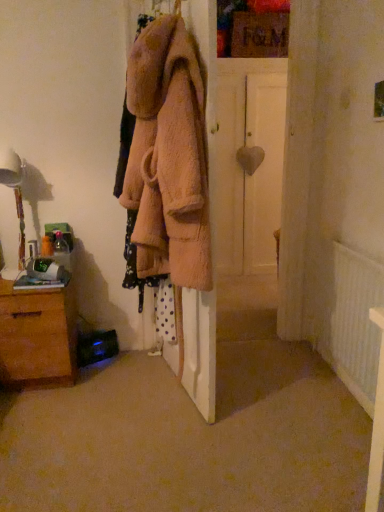
Identify the location of white textured radiator at lower right. This screenshot has width=384, height=512. (350, 319).

Where is `white glossy table lamp at left`? white glossy table lamp at left is located at coordinates (15, 193).

Considering the positions of points (76, 374) and (264, 206), is point (76, 374) farther from camera compared to point (264, 206)?

No, (76, 374) is closer to viewer.

Based on their positions, is brown wooden chest of drawers at lower left located to the left or right of white matte door at center?

Clearly, brown wooden chest of drawers at lower left is on the left of white matte door at center in the image.

From a real-world perspective, which is physically above, brown wooden chest of drawers at lower left or white matte door at center?

white matte door at center is physically above.

From the picture: How different are the orientations of brown wooden chest of drawers at lower left and white matte door at center in degrees?

The angular difference between brown wooden chest of drawers at lower left and white matte door at center is 2.53 degrees.

Is white textured radiator at lower right positioned far away from white matte door at center?

Indeed, white textured radiator at lower right is not near white matte door at center.

Would you say white textured radiator at lower right is to the left or to the right of white matte door at center in the picture?

white textured radiator at lower right is to the right of white matte door at center.

Which object is further away from the camera taking this photo, white textured radiator at lower right or white matte door at center?

white matte door at center is further from the camera.

Based on the photo, how much distance is there between white textured radiator at lower right and white matte door at center?

white textured radiator at lower right is 1.55 meters from white matte door at center.

Considering the positions of objects white glossy table lamp at left and soft pink fuzzy coat at center in the image provided, who is more to the right, white glossy table lamp at left or soft pink fuzzy coat at center?

Positioned to the right is soft pink fuzzy coat at center.

I want to click on clothing in front of the white glossy table lamp at left, so click(166, 157).

Is white glossy table lamp at left aimed at soft pink fuzzy coat at center?

No, white glossy table lamp at left is not oriented towards soft pink fuzzy coat at center.

In the scene shown: From the image's perspective, is white glossy table lamp at left on top of soft pink fuzzy coat at center?

Yes, from the image's perspective, white glossy table lamp at left is above soft pink fuzzy coat at center.

Is white textured radiator at lower right inside white matte door at center?

Definitely not — white textured radiator at lower right is not inside white matte door at center.

Consider the image. How far apart are white matte door at center and white textured radiator at lower right?

white matte door at center and white textured radiator at lower right are 1.55 meters apart.

The image size is (384, 512). Find the location of `radiator to the right of white matte door at center`. radiator to the right of white matte door at center is located at coordinates (350, 319).

Who is taller, white matte door at center or white textured radiator at lower right?

white matte door at center.

In terms of width, does brown wooden chest of drawers at lower left look wider or thinner when compared to white glossy table lamp at left?

brown wooden chest of drawers at lower left is wider than white glossy table lamp at left.

Considering the sizes of brown wooden chest of drawers at lower left and white glossy table lamp at left in the image, is brown wooden chest of drawers at lower left taller or shorter than white glossy table lamp at left?

In the image, brown wooden chest of drawers at lower left appears to be shorter than white glossy table lamp at left.

Is brown wooden chest of drawers at lower left facing towards white glossy table lamp at left?

No, brown wooden chest of drawers at lower left does not turn towards white glossy table lamp at left.

In the scene shown: Considering the sizes of objects white matte door at center and fuzzy pink coat at upper center in the image provided, who is smaller, white matte door at center or fuzzy pink coat at upper center?

fuzzy pink coat at upper center is smaller.

Between white matte door at center and fuzzy pink coat at upper center, which one has less height?

fuzzy pink coat at upper center is shorter.

From a real-world perspective, which object stands above the other?

From a 3D spatial view, fuzzy pink coat at upper center is above.

Looking at this image, is brown wooden chest of drawers at lower left not close to soft pink fuzzy coat at center?

No, brown wooden chest of drawers at lower left is not far from soft pink fuzzy coat at center.

Between brown wooden chest of drawers at lower left and soft pink fuzzy coat at center, which one appears on the right side from the viewer's perspective?

soft pink fuzzy coat at center.

Is soft pink fuzzy coat at center at the back of brown wooden chest of drawers at lower left?

brown wooden chest of drawers at lower left does not have its back to soft pink fuzzy coat at center.

The height and width of the screenshot is (512, 384). I want to click on door above the brown wooden chest of drawers at lower left (from the image's perspective), so click(243, 170).

Identify the location of radiator below the white matte door at center (from the image's perspective). (350, 319).

From the picture: When comparing their distances from white matte door at center, does white textured radiator at lower right or fuzzy pink coat at upper center seem closer?

white textured radiator at lower right is positioned closer to the anchor white matte door at center.

When comparing their distances from white matte door at center, does soft pink fuzzy coat at center or white textured radiator at lower right seem closer?

white textured radiator at lower right.

Which object lies nearer to the anchor point fuzzy pink coat at upper center, soft pink fuzzy coat at center or white matte door at center?

soft pink fuzzy coat at center.

When comparing their distances from brown wooden chest of drawers at lower left, does soft pink fuzzy coat at center or fuzzy pink coat at upper center seem closer?

soft pink fuzzy coat at center is positioned closer to the anchor brown wooden chest of drawers at lower left.

Considering their positions, is white glossy table lamp at left positioned closer to fuzzy pink coat at upper center than brown wooden chest of drawers at lower left?

white glossy table lamp at left.

Estimate the real-world distances between objects in this image. Which object is further from fuzzy pink coat at upper center, white matte door at center or brown wooden chest of drawers at lower left?

white matte door at center is positioned further to the anchor fuzzy pink coat at upper center.

When comparing their distances from white glossy table lamp at left, does soft pink fuzzy coat at center or white matte door at center seem further?

The object further to white glossy table lamp at left is white matte door at center.

Considering their positions, is white textured radiator at lower right positioned further to brown wooden chest of drawers at lower left than white glossy table lamp at left?

The object further to brown wooden chest of drawers at lower left is white textured radiator at lower right.

Where is `hanger between soft pink fuzzy coat at center and white matte door at center from front to back`? hanger between soft pink fuzzy coat at center and white matte door at center from front to back is located at coordinates 157,12.

Identify the location of the chest of drawers located between white glossy table lamp at left and soft pink fuzzy coat at center in the left-right direction. (37, 336).

Where is `radiator between soft pink fuzzy coat at center and white matte door at center in the front-back direction`? This screenshot has height=512, width=384. radiator between soft pink fuzzy coat at center and white matte door at center in the front-back direction is located at coordinates (350, 319).

The width and height of the screenshot is (384, 512). I want to click on hanger between white glossy table lamp at left and white textured radiator at lower right in the horizontal direction, so click(x=157, y=12).